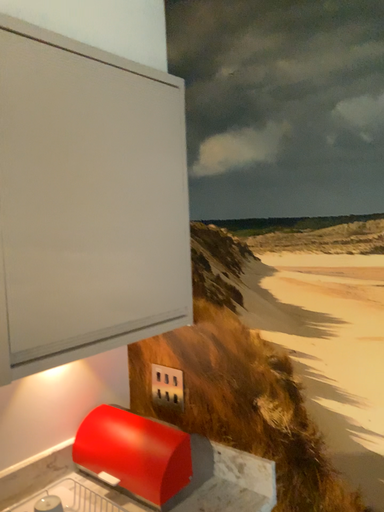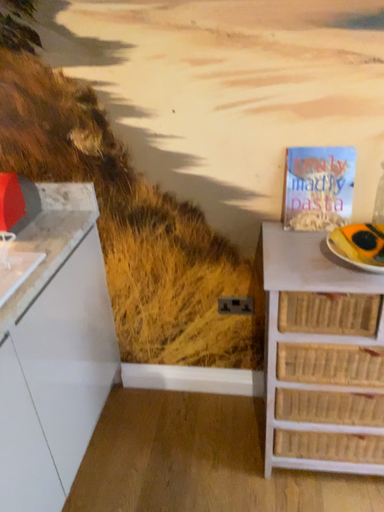
Question: Which way did the camera rotate in the video?

Choices:
 (A) rotated upward
 (B) rotated downward

Answer: (B)